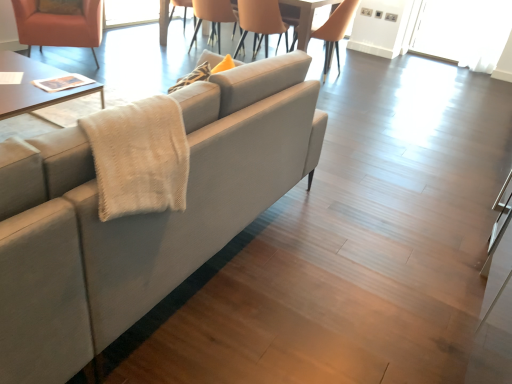
Question: In terms of height, does matte beige chair at upper center, placed as the second chair when sorted from right to left, look taller or shorter compared to transparent glass door at upper right?

Choices:
 (A) tall
 (B) short

Answer: (B)

Question: From the image's perspective, relative to transparent glass door at upper right, is matte beige chair at upper center, placed as the second chair when sorted from right to left, above or below?

Choices:
 (A) below
 (B) above

Answer: (A)

Question: Which object is the closest to the matte orange armchair at upper left, which is counted as the first chair, starting from the left?

Choices:
 (A) wooden glossy table at upper center
 (B) transparent glass door at upper right
 (C) light gray fabric couch at center
 (D) matte beige chair at upper center, which appears as the third chair when viewed from the left
 (E) light brown leather chair at upper center, which is the 4th chair from left to right

Answer: (D)

Question: Estimate the real-world distances between objects in this image. Which object is closer to the matte orange armchair at upper left, the 4th chair viewed from the right?

Choices:
 (A) light gray fabric couch at center
 (B) transparent glass door at upper right
 (C) matte beige chair at upper center, placed as the second chair when sorted from right to left
 (D) light brown leather chair at upper center, which is the 4th chair from left to right
 (E) orange leather chair at upper center, which is counted as the third chair, starting from the right

Answer: (E)